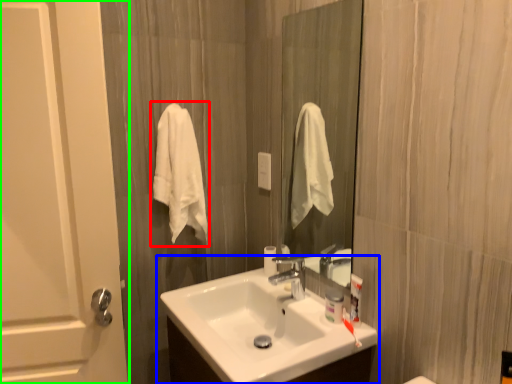
Question: Considering the real-world distances, which object is farthest from bath towel (highlighted by a red box)? sink (highlighted by a blue box) or door (highlighted by a green box)?

Choices:
 (A) sink
 (B) door

Answer: (A)